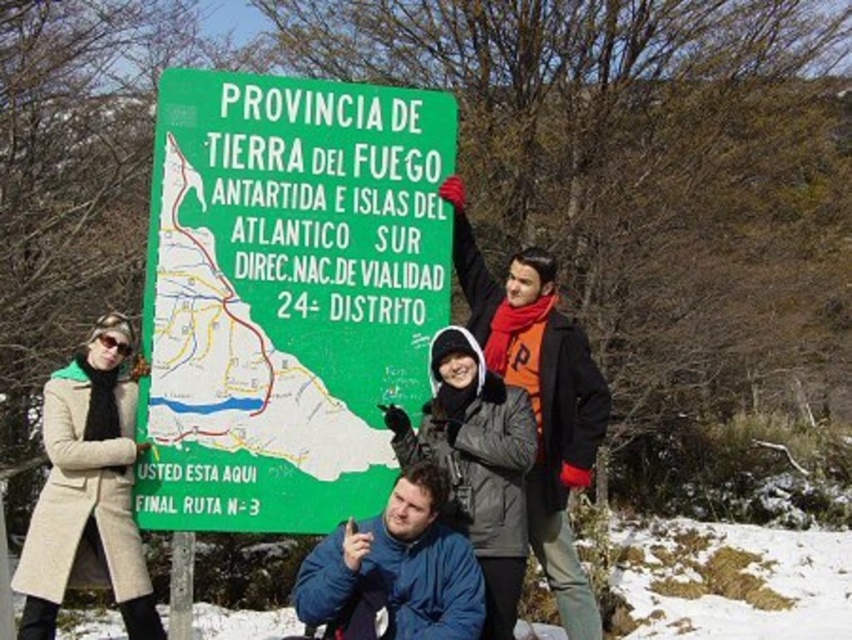
You are a photographer trying to capture both the dark blue jacket at center and the blue fleece jacket at lower center in a single frame. Given their sizes, which jacket will appear bigger in the photo?

The dark blue jacket at center will appear bigger in the photo because it is larger in size than the blue fleece jacket at lower center.

From the picture: You are a photographer trying to capture a photo of the dark blue jacket at center and the blue fleece jacket at lower center. Since you want both jackets to be clearly visible in the frame, which jacket should you focus on first to ensure the other remains in focus?

The dark blue jacket at center is positioned over the blue fleece jacket at lower center, so focusing on the dark blue jacket at center first will ensure the blue fleece jacket at lower center stays in focus as it is behind.

You are a photographer trying to capture a group photo of the dark blue jacket at center and the blue fleece jacket at lower center. If you want to ensure both jackets are fully visible in the frame, which person should you position closer to the camera?

The dark blue jacket at center has a smaller width than the blue fleece jacket at lower center. To ensure both are fully visible, position the dark blue jacket at center closer to the camera so its smaller size can be better captured without cropping.